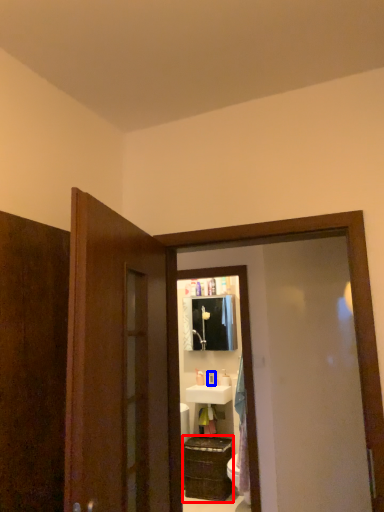
Question: Which object appears closest to the camera in this image, cabinetry (highlighted by a red box) or toiletry (highlighted by a blue box)?

Choices:
 (A) cabinetry
 (B) toiletry

Answer: (A)